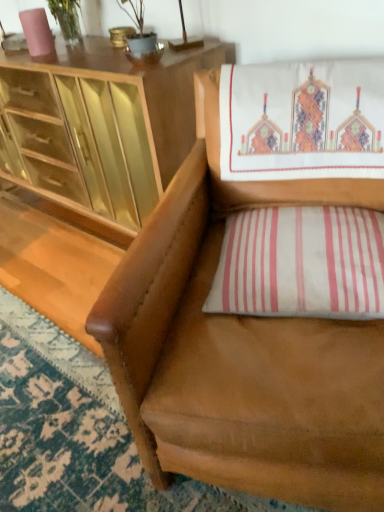
Question: Considering the relative positions of brown leather chair at center and white striped pillow at lower right in the image provided, is brown leather chair at center to the left of white striped pillow at lower right from the viewer's perspective?

Choices:
 (A) no
 (B) yes

Answer: (B)

Question: Considering the relative sizes of brown leather chair at center and white striped pillow at lower right in the image provided, is brown leather chair at center thinner than white striped pillow at lower right?

Choices:
 (A) no
 (B) yes

Answer: (A)

Question: Is brown leather chair at center in front of white striped pillow at lower right?

Choices:
 (A) yes
 (B) no

Answer: (A)

Question: Is brown leather chair at center wider than white striped pillow at lower right?

Choices:
 (A) no
 (B) yes

Answer: (B)

Question: Considering the relative sizes of brown leather chair at center and white striped pillow at lower right in the image provided, is brown leather chair at center smaller than white striped pillow at lower right?

Choices:
 (A) yes
 (B) no

Answer: (B)

Question: Is brown leather chair at center positioned with its back to white striped pillow at lower right?

Choices:
 (A) yes
 (B) no

Answer: (A)

Question: Considering the relative sizes of white striped pillow at lower right and matte wood cabinet at upper left in the image provided, is white striped pillow at lower right bigger than matte wood cabinet at upper left?

Choices:
 (A) no
 (B) yes

Answer: (A)

Question: Considering the relative positions of white striped pillow at lower right and matte wood cabinet at upper left in the image provided, is white striped pillow at lower right to the left of matte wood cabinet at upper left from the viewer's perspective?

Choices:
 (A) no
 (B) yes

Answer: (A)

Question: Is matte wood cabinet at upper left located within white striped pillow at lower right?

Choices:
 (A) no
 (B) yes

Answer: (A)

Question: From a real-world perspective, does white striped pillow at lower right stand above matte wood cabinet at upper left?

Choices:
 (A) yes
 (B) no

Answer: (A)

Question: Is white striped pillow at lower right far away from matte wood cabinet at upper left?

Choices:
 (A) no
 (B) yes

Answer: (A)

Question: Can you confirm if white striped pillow at lower right is wider than matte wood cabinet at upper left?

Choices:
 (A) no
 (B) yes

Answer: (A)

Question: Considering the relative sizes of matte wood cabinet at upper left and white striped pillow at lower right in the image provided, is matte wood cabinet at upper left smaller than white striped pillow at lower right?

Choices:
 (A) yes
 (B) no

Answer: (B)